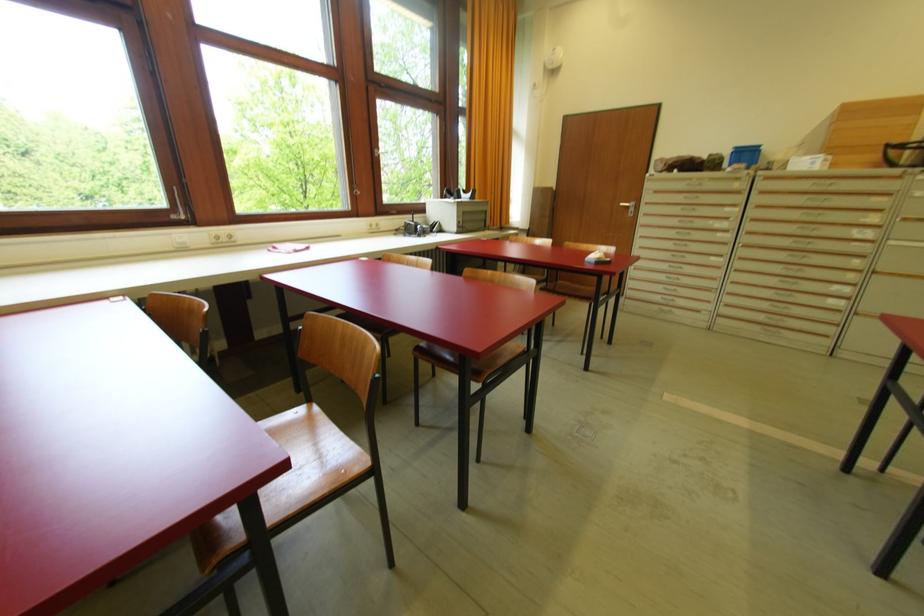
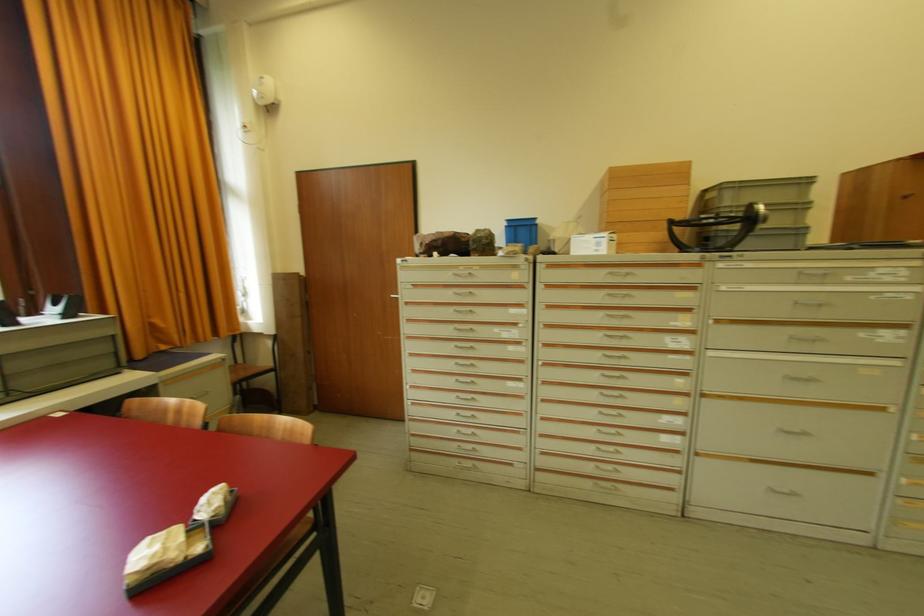
Find the pixel in the second image that matches point 786,171 in the first image.

(570, 254)